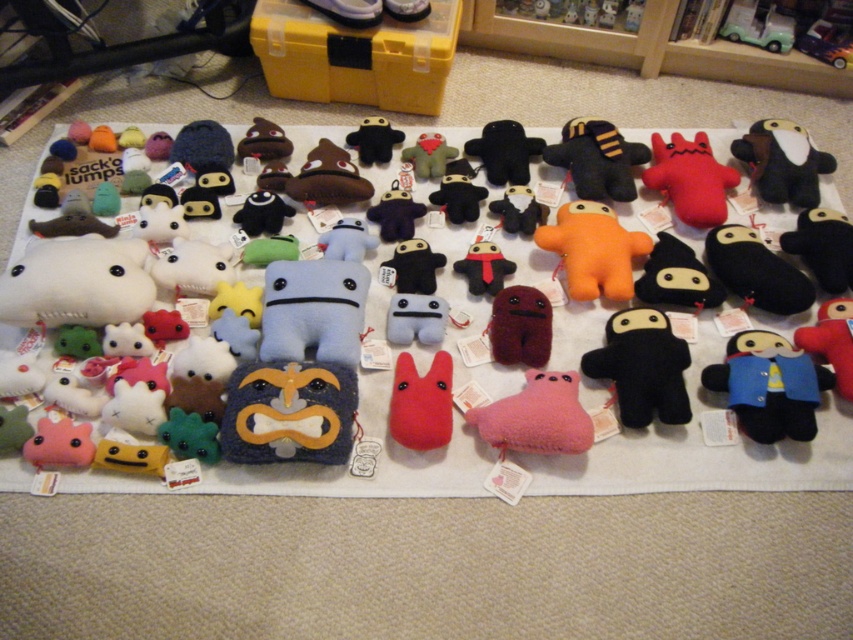
Question: Which of the following is the farthest from the observer?

Choices:
 (A) (773, 200)
 (B) (225, 408)
 (C) (780, 381)

Answer: (A)

Question: Which object appears closest to the camera in this image?

Choices:
 (A) black plush ninja at center-right
 (B) red plush rabbit at center

Answer: (B)

Question: Is fluffy blue plush at center further to the viewer compared to orange plush at center?

Choices:
 (A) no
 (B) yes

Answer: (A)

Question: Is fluffy pink plush at center smaller than velvet plush panda at upper right?

Choices:
 (A) yes
 (B) no

Answer: (A)

Question: Does red plush toy at center-right have a larger size compared to velvety black ninja at center?

Choices:
 (A) yes
 (B) no

Answer: (A)

Question: Among these objects, which one is farthest from the camera?

Choices:
 (A) fluffy blue plush at center
 (B) black plush ninja at center-right
 (C) red plush toy at center-right
 (D) orange plush at center

Answer: (C)